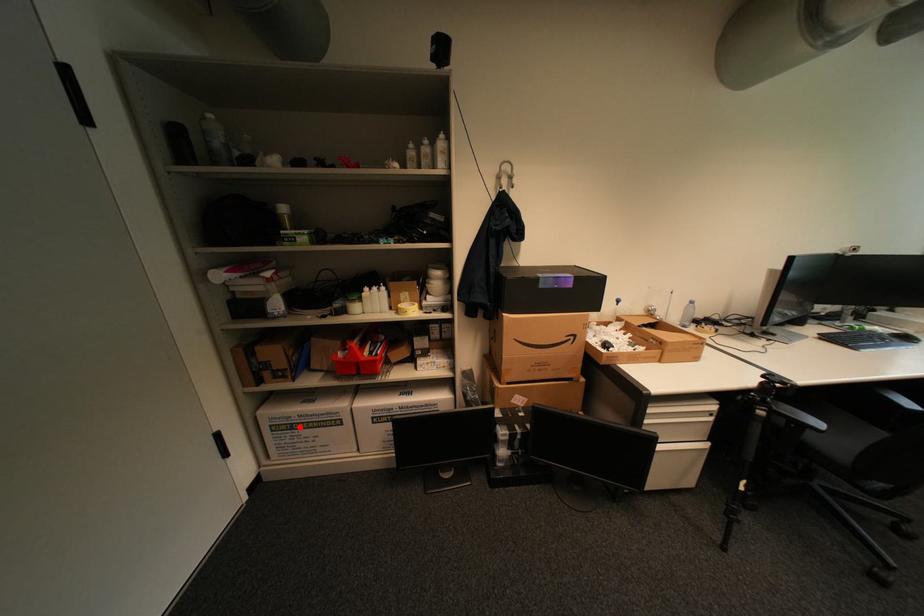
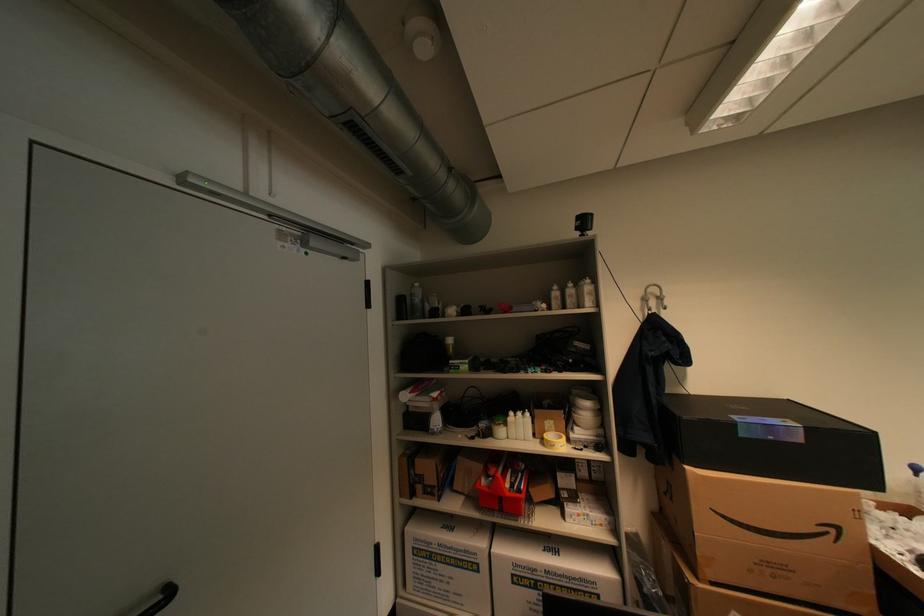
Locate, in the second image, the point that corresponds to the highlighted location in the first image.

(439, 556)